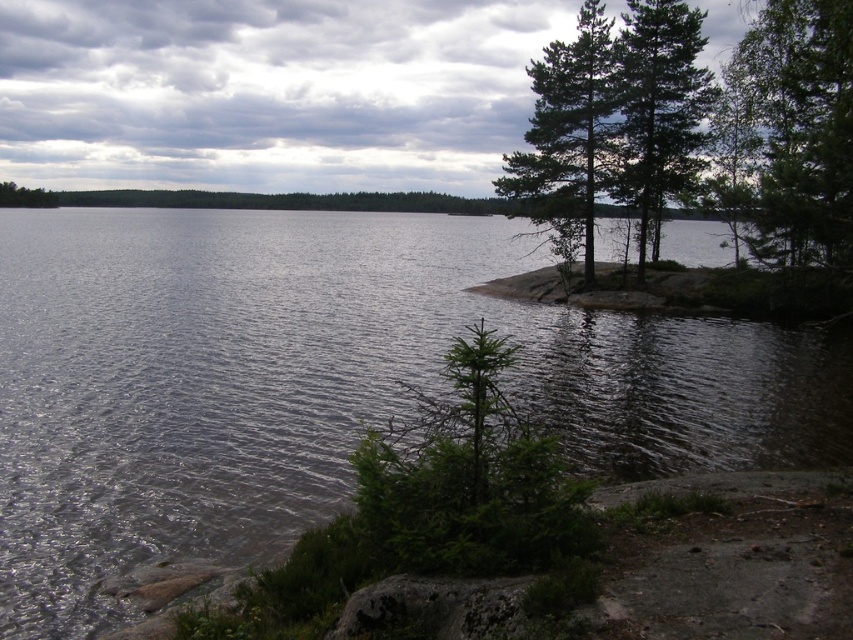
Question: Does dark gray water at center have a larger size compared to green matte tree at upper right?

Choices:
 (A) yes
 (B) no

Answer: (A)

Question: Estimate the real-world distances between objects in this image. Which object is farther from the green matte tree at right?

Choices:
 (A) green textured pine trees at upper right
 (B) green matte tree at upper right

Answer: (A)

Question: Estimate the real-world distances between objects in this image. Which object is closer to the dark gray water at center?

Choices:
 (A) green matte tree at right
 (B) green textured pine trees at upper right
 (C) green matte tree at upper right

Answer: (C)

Question: Which of the following is the farthest from the observer?

Choices:
 (A) (556, 67)
 (B) (300, 243)
 (C) (639, 234)

Answer: (B)

Question: Does green matte tree at upper right have a larger size compared to green matte tree at right?

Choices:
 (A) no
 (B) yes

Answer: (B)

Question: Is dark gray water at center smaller than green matte tree at right?

Choices:
 (A) no
 (B) yes

Answer: (A)